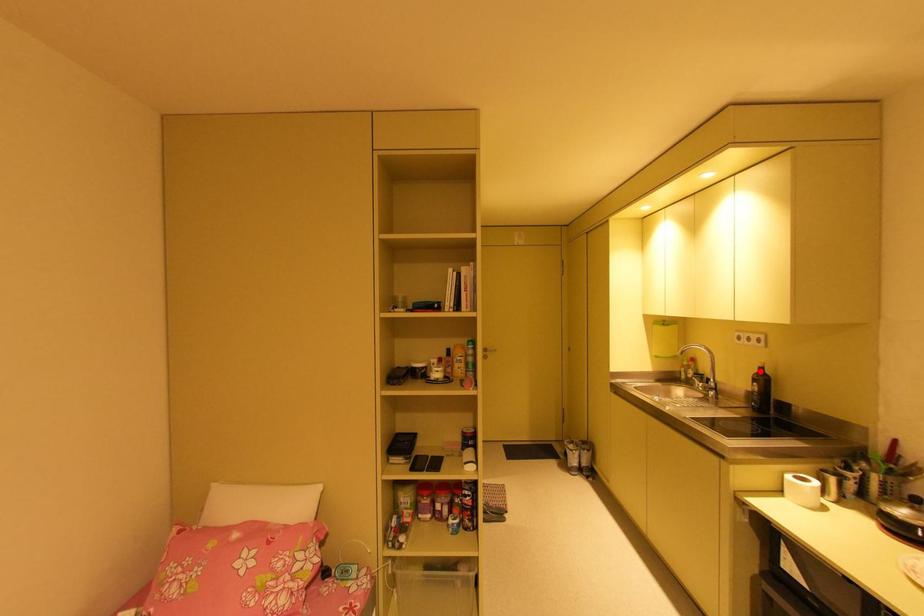
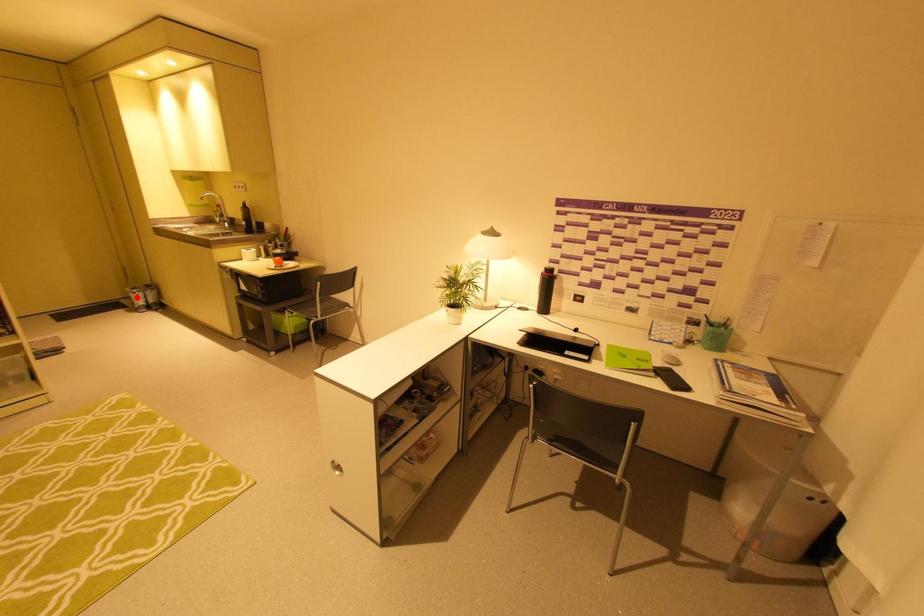
I am providing you with two images of the same scene from different viewpoints. A red point is marked on the first image and another point is marked on the second image. Is the red point in image1 aligned with the point shown in image2?

No